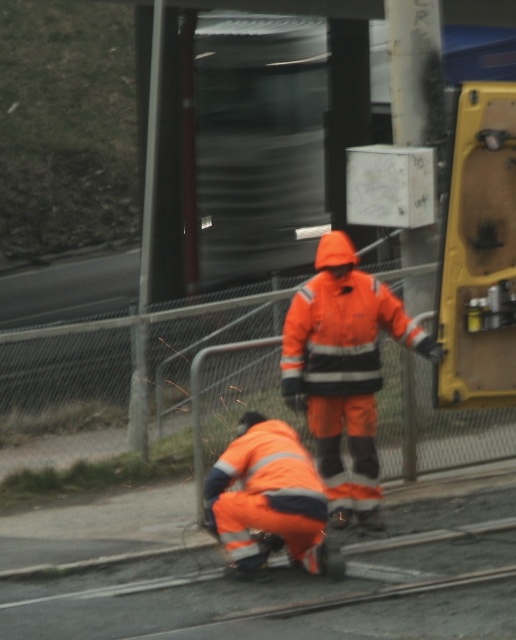
Question: Can you confirm if orange reflective suit at center is positioned to the right of reflective orange jumpsuit at lower center?

Choices:
 (A) yes
 (B) no

Answer: (A)

Question: Among these objects, which one is farthest from the camera?

Choices:
 (A) reflective orange jumpsuit at lower center
 (B) orange reflective suit at center

Answer: (B)

Question: Does orange reflective suit at center appear under reflective orange jumpsuit at lower center?

Choices:
 (A) yes
 (B) no

Answer: (B)

Question: Which point appears farthest from the camera in this image?

Choices:
 (A) (296, 493)
 (B) (395, 330)

Answer: (B)

Question: Is orange reflective suit at center to the left of reflective orange jumpsuit at lower center from the viewer's perspective?

Choices:
 (A) yes
 (B) no

Answer: (B)